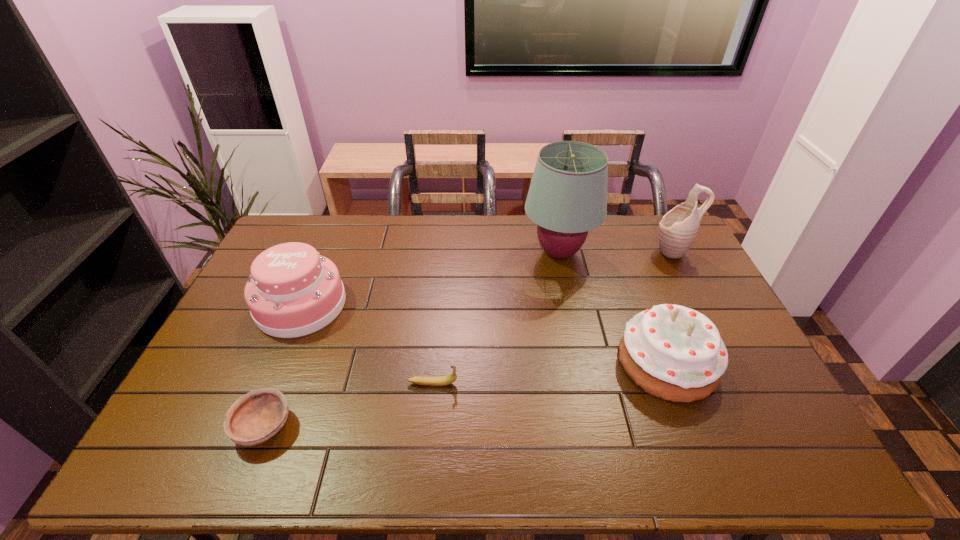
The height and width of the screenshot is (540, 960). I want to click on pitcher located in the right edge section of the desktop, so click(x=677, y=230).

Where is `cake that is at the right edge`? The width and height of the screenshot is (960, 540). cake that is at the right edge is located at coordinates (675, 353).

I want to click on object present at the near left corner, so click(254, 418).

The image size is (960, 540). What are the coordinates of `object positioned at the far right corner` in the screenshot? It's located at (677, 230).

I want to click on free space at the far edge, so click(x=349, y=234).

The image size is (960, 540). In the image, there is a desktop. Find the location of `free space at the right edge`. free space at the right edge is located at coordinates (749, 383).

Locate an element on the screen. The image size is (960, 540). free region at the far left corner of the desktop is located at coordinates (300, 238).

Locate an element on the screen. The image size is (960, 540). free space at the near right corner of the desktop is located at coordinates (783, 463).

Find the location of `free space between the fifth shortest object and the left cake`. free space between the fifth shortest object and the left cake is located at coordinates [487, 278].

Identify the location of unoccupied area between the bowl and the left cake. The image size is (960, 540). (282, 366).